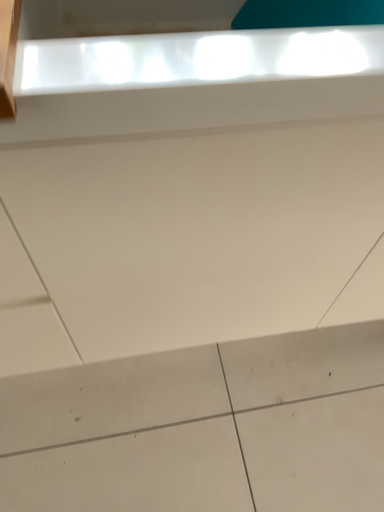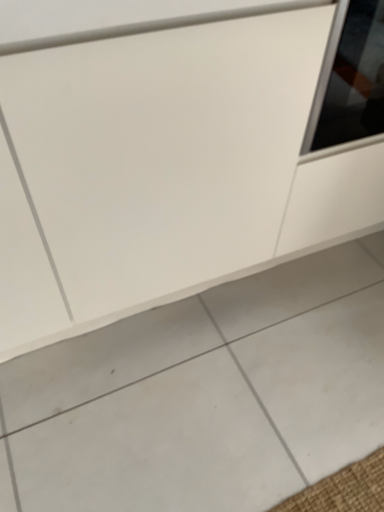
Question: Which way did the camera rotate in the video?

Choices:
 (A) rotated right
 (B) rotated left

Answer: (A)